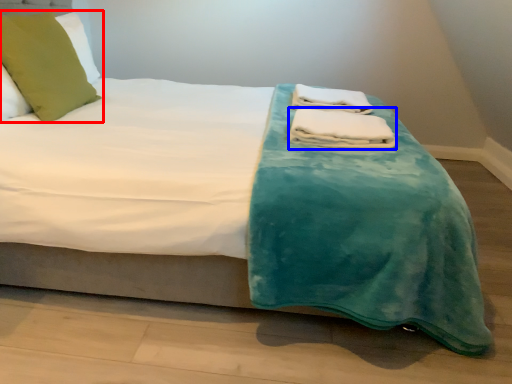
Question: Which object appears farthest to the camera in this image, pillow (highlighted by a red box) or bath towel (highlighted by a blue box)?

Choices:
 (A) pillow
 (B) bath towel

Answer: (A)